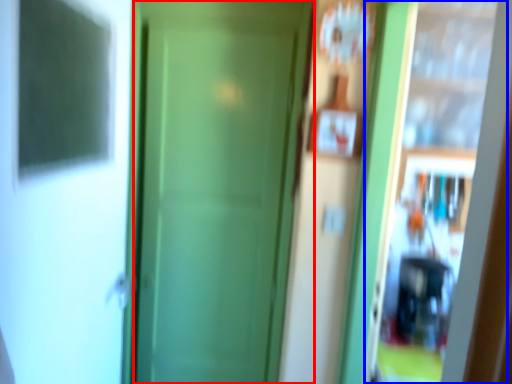
Question: Which of the following is the farthest to the observer, door (highlighted by a red box) or screen door (highlighted by a blue box)?

Choices:
 (A) door
 (B) screen door

Answer: (A)